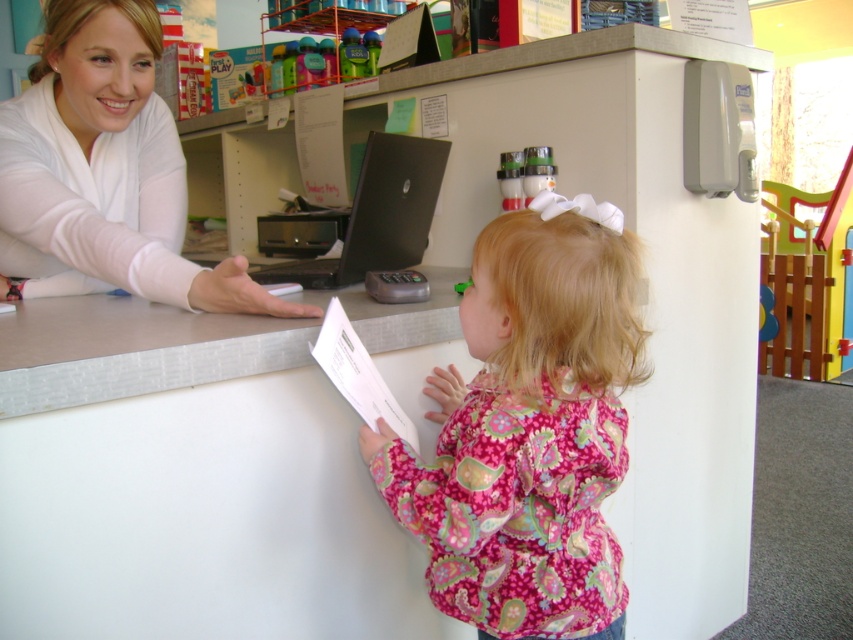
Can you confirm if pink floral shirt at center is positioned to the left of matte white shirt at upper left?

No, pink floral shirt at center is not to the left of matte white shirt at upper left.

Can you confirm if pink floral shirt at center is taller than matte white shirt at upper left?

Yes, pink floral shirt at center is taller than matte white shirt at upper left.

Does point (495, 545) lie behind point (115, 26)?

No, it is not.

The width and height of the screenshot is (853, 640). In order to click on pink floral shirt at center in this screenshot , I will do pyautogui.click(x=527, y=433).

Can you confirm if matte white shirt at upper left is positioned above black matte laptop at center?

Incorrect, matte white shirt at upper left is not positioned above black matte laptop at center.

Who is more forward, (x=91, y=36) or (x=316, y=237)?

Point (x=91, y=36)

Who is more distant from viewer, (120,90) or (399,140)?

Positioned behind is point (399,140).

I want to click on matte white shirt at upper left, so click(106, 170).

Is white smooth desk at center above pink floral shirt at center?

No.

Does point (265, 426) lie behind point (515, 637)?

Yes.

Identify the location of white smooth desk at center. (189, 486).